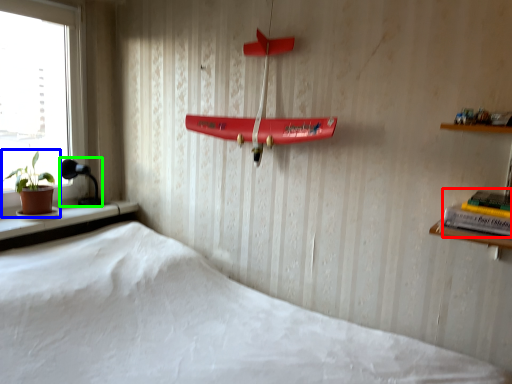
Question: Considering the real-world distances, which object is closest to book (highlighted by a red box)? houseplant (highlighted by a blue box) or lamp (highlighted by a green box).

Choices:
 (A) houseplant
 (B) lamp

Answer: (A)